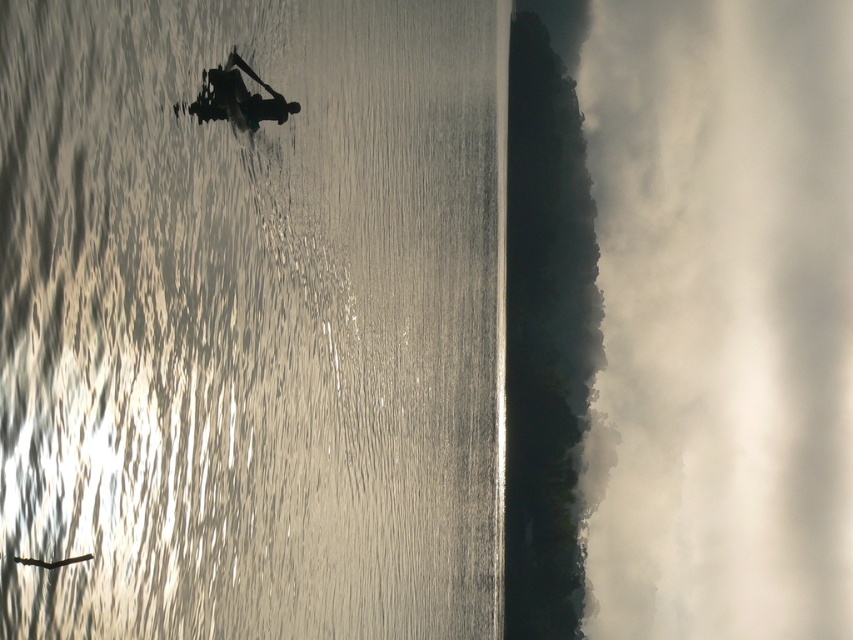
Question: Is reflective silver water at center above silhouette wooden boat at upper center?

Choices:
 (A) no
 (B) yes

Answer: (A)

Question: Can you confirm if reflective silver water at center is positioned to the right of silhouette wooden boat at upper center?

Choices:
 (A) yes
 (B) no

Answer: (A)

Question: Which object is closer to the camera taking this photo?

Choices:
 (A) silhouette wooden boat at upper center
 (B) reflective silver water at center

Answer: (B)

Question: Among these points, which one is farthest from the camera?

Choices:
 (A) (267, 120)
 (B) (120, 113)

Answer: (A)

Question: Considering the relative positions of reflective silver water at center and silhouette wooden boat at upper center in the image provided, where is reflective silver water at center located with respect to silhouette wooden boat at upper center?

Choices:
 (A) left
 (B) right

Answer: (B)